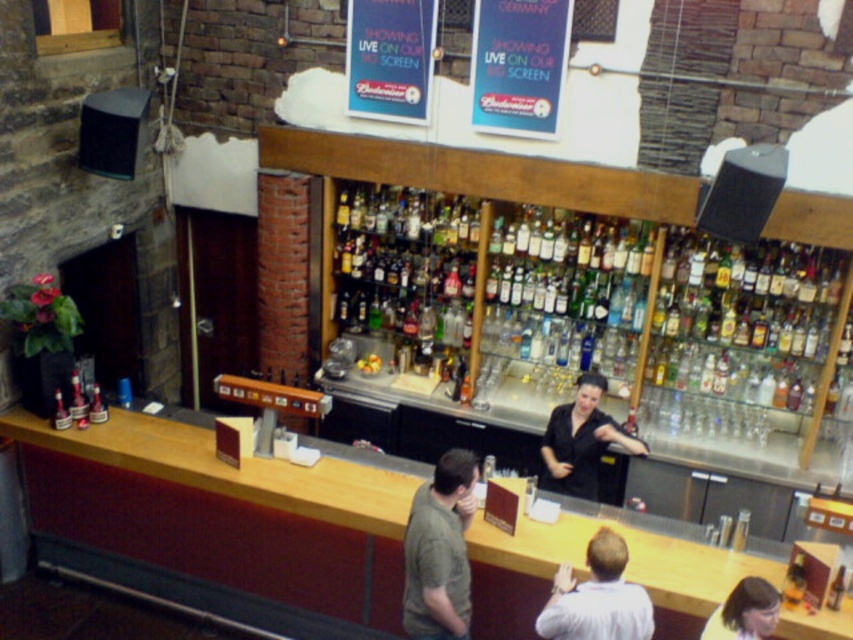
Looking at this image, you are a bartender preparing to place a new bottle on the counter. You have a matte green shirt at center and a blonde hair at lower right in your view. Which of these two items has a smaller width?

The matte green shirt at center has a lesser width compared to the blonde hair at lower right, so the matte green shirt at center is smaller in width.

You are a customer at the bar and want to place your drink on the counter. There are two points marked on the counter. The first point is at coordinate point (462, 481) and the second is at point (741, 628). Which point is closer to you as you sit at the bar?

Point (741, 628) is closer to you because point (462, 481) is behind it.

You are a bartender who needs to choose a shirt to wear. You have two options displayed in the bar scene. Which shirt, the matte green shirt at center or the black matte shirt at center, is the smaller one in size?

The matte green shirt at center is smaller than the black matte shirt at center, so the matte green shirt at center is the smaller one in size.